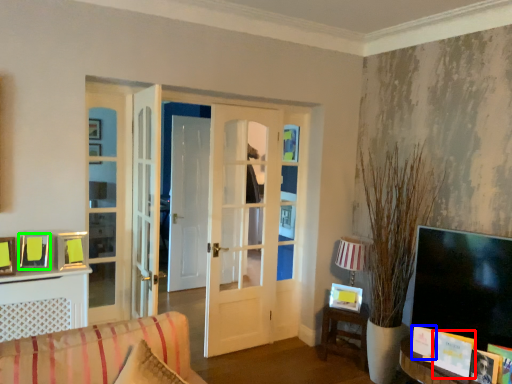
Question: Which object is the farthest from book (highlighted by a red box)? Choose among these: picture frame (highlighted by a blue box) or picture frame (highlighted by a green box).

Choices:
 (A) picture frame
 (B) picture frame

Answer: (B)